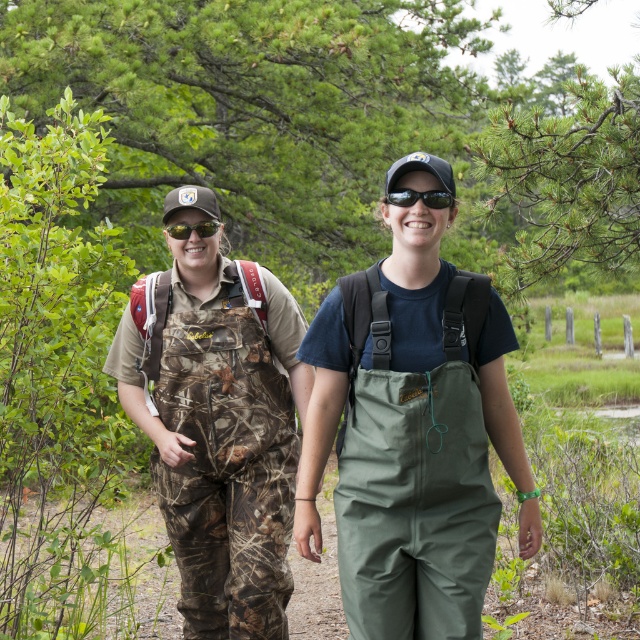
Looking at this image, you are a photographer trying to capture a closeup shot of both the black reflective sunglasses at center and the matte black goggles at center. Since you want them to appear equally sized in your photo, which object should you move closer to the camera?

Since the black reflective sunglasses at center is wider than the matte black goggles at center, you should move the matte black goggles at center closer to the camera to make them appear the same size in the photo.

What is the object located at the coordinates point (228,435) in the image?

The object located at point (228,435) is the camouflage fabric overalls at center.